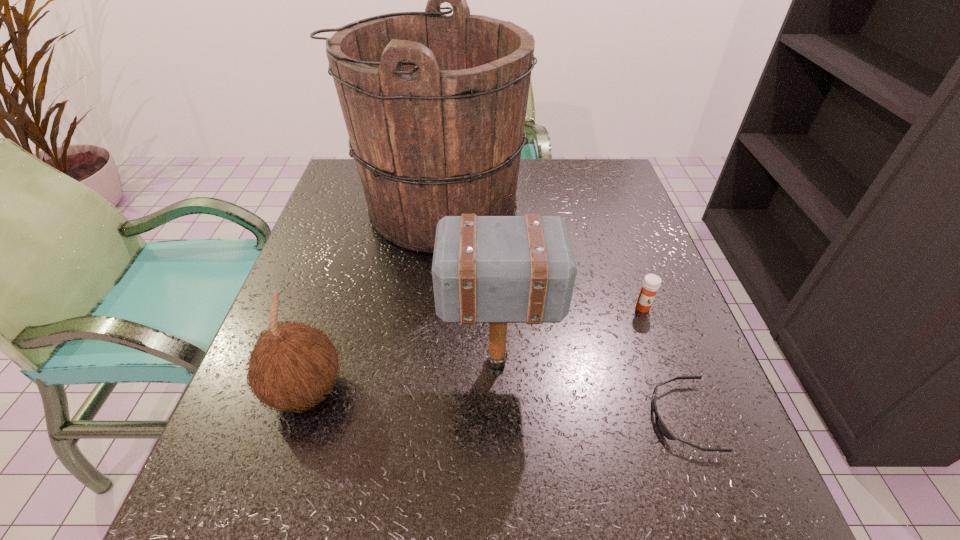
You are a GUI agent. You are given a task and a screenshot of the screen. Output one action in this format:
    pyautogui.click(x=<x>, y=<y>)
    Task: Click on the vacant area that lies between the third shortest object and the farthest object
    This screenshot has height=540, width=960.
    Given the screenshot: What is the action you would take?
    pyautogui.click(x=371, y=299)

This screenshot has width=960, height=540. I want to click on vacant area that lies between the medicine and the coconut, so click(474, 349).

You are a GUI agent. You are given a task and a screenshot of the screen. Output one action in this format:
    pyautogui.click(x=<x>, y=<y>)
    Task: Click on the free space between the mallet and the sunglasses
    Image resolution: width=960 pixels, height=540 pixels.
    Given the screenshot: What is the action you would take?
    pyautogui.click(x=589, y=389)

At what (x,y) coordinates should I click in order to perform the action: click on free space between the third shortest object and the shortest object. Please return your answer as a coordinate pair (x, y). Looking at the image, I should click on (493, 404).

This screenshot has width=960, height=540. Identify the location of free space that is in between the medicine and the shortest object. (662, 362).

Find the location of `unoccupied area between the third tallest object and the mallet`. unoccupied area between the third tallest object and the mallet is located at coordinates pos(401,376).

Find the location of `the fourth closest object to the sunglasses`. the fourth closest object to the sunglasses is located at coordinates (292, 365).

Choose which object is the nearest neighbor to the sunglasses. Please provide its 2D coordinates. Your answer should be formatted as a tuple, i.e. [(x, y)], where the tuple contains the x and y coordinates of a point satisfying the conditions above.

[(486, 269)]

Where is `free point that satisfies the following two spatial constraints: 1. on the front side of the tallest object; 2. on the surface of the third shortest object`? free point that satisfies the following two spatial constraints: 1. on the front side of the tallest object; 2. on the surface of the third shortest object is located at coordinates (414, 390).

Locate an element on the screen. free space that satisfies the following two spatial constraints: 1. on the label side of the fourth tallest object; 2. on the striking surface of the second tallest object is located at coordinates (661, 362).